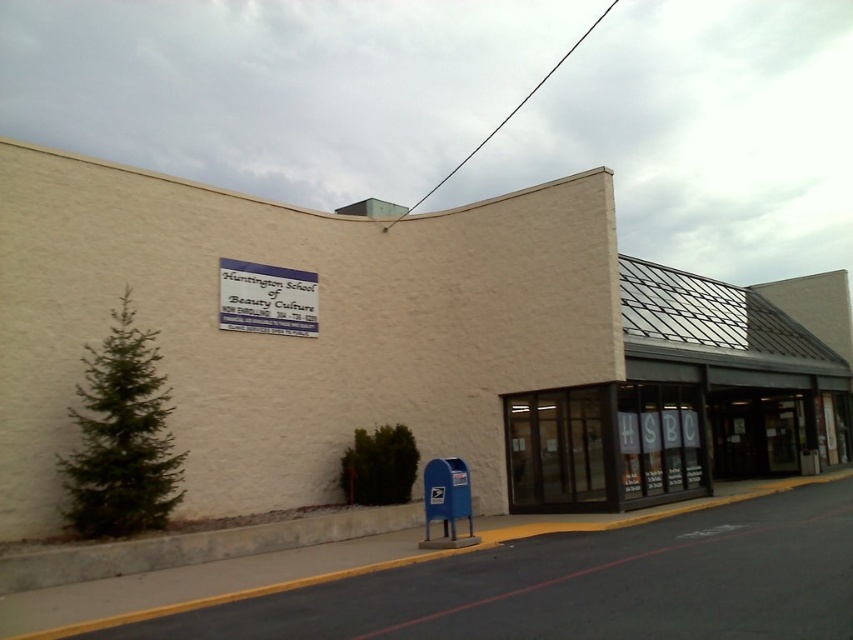
Question: Is clear glass storefront at lower right below blue plastic sign at upper center?

Choices:
 (A) yes
 (B) no

Answer: (A)

Question: Among these points, which one is farthest from the camera?

Choices:
 (A) (270, 266)
 (B) (535, 410)

Answer: (B)

Question: Is clear glass storefront at lower right thinner than blue plastic sign at upper center?

Choices:
 (A) yes
 (B) no

Answer: (B)

Question: Considering the relative positions of clear glass storefront at lower right and blue plastic sign at upper center in the image provided, where is clear glass storefront at lower right located with respect to blue plastic sign at upper center?

Choices:
 (A) above
 (B) below

Answer: (B)

Question: Which point appears closest to the camera in this image?

Choices:
 (A) (310, 284)
 (B) (711, 432)

Answer: (A)